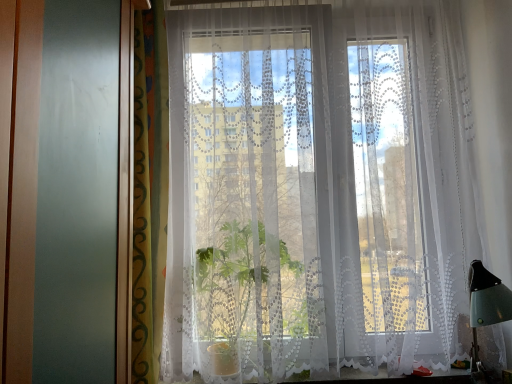
Question: From a real-world perspective, is white lace curtain at center, placed as the 2th curtain when sorted from left to right, physically above green patterned curtain at left, the first curtain positioned from the left?

Choices:
 (A) no
 (B) yes

Answer: (A)

Question: From a real-world perspective, is white lace curtain at center, placed as the 2th curtain when sorted from left to right, beneath green patterned curtain at left, arranged as the second curtain when viewed from the right?

Choices:
 (A) yes
 (B) no

Answer: (A)

Question: From the image's perspective, does white lace curtain at center, placed as the 2th curtain when sorted from left to right, appear higher than green patterned curtain at left, arranged as the second curtain when viewed from the right?

Choices:
 (A) yes
 (B) no

Answer: (A)

Question: Does white lace curtain at center, positioned as the 1th curtain in right-to-left order, appear on the right side of green patterned curtain at left, arranged as the second curtain when viewed from the right?

Choices:
 (A) no
 (B) yes

Answer: (B)

Question: Is white lace curtain at center, placed as the 2th curtain when sorted from left to right, positioned behind green patterned curtain at left, arranged as the second curtain when viewed from the right?

Choices:
 (A) yes
 (B) no

Answer: (A)

Question: Considering the relative positions of white lace curtain at center, placed as the 2th curtain when sorted from left to right, and green patterned curtain at left, the first curtain positioned from the left, in the image provided, is white lace curtain at center, placed as the 2th curtain when sorted from left to right, to the left or to the right of green patterned curtain at left, the first curtain positioned from the left,?

Choices:
 (A) left
 (B) right

Answer: (B)

Question: Is white lace curtain at center, positioned as the 1th curtain in right-to-left order, inside or outside of green patterned curtain at left, the first curtain positioned from the left?

Choices:
 (A) inside
 (B) outside

Answer: (B)

Question: Is point (266, 107) closer or farther from the camera than point (144, 264)?

Choices:
 (A) farther
 (B) closer

Answer: (A)

Question: Considering their positions, is white lace curtain at center, placed as the 2th curtain when sorted from left to right, located in front of or behind green patterned curtain at left, arranged as the second curtain when viewed from the right?

Choices:
 (A) behind
 (B) front

Answer: (A)

Question: Looking at their shapes, would you say green patterned curtain at left, arranged as the second curtain when viewed from the right, is wider or thinner than white lace curtain at center, placed as the 2th curtain when sorted from left to right?

Choices:
 (A) wide
 (B) thin

Answer: (B)

Question: Based on their positions, is green patterned curtain at left, the first curtain positioned from the left, located to the left or right of white lace curtain at center, positioned as the 1th curtain in right-to-left order?

Choices:
 (A) left
 (B) right

Answer: (A)

Question: Is green patterned curtain at left, the first curtain positioned from the left, bigger or smaller than white lace curtain at center, placed as the 2th curtain when sorted from left to right?

Choices:
 (A) small
 (B) big

Answer: (A)

Question: Is green patterned curtain at left, the first curtain positioned from the left, taller or shorter than white lace curtain at center, placed as the 2th curtain when sorted from left to right?

Choices:
 (A) short
 (B) tall

Answer: (A)

Question: From a real-world perspective, is green patterned curtain at left, arranged as the second curtain when viewed from the right, above or below white lace curtain at lower center?

Choices:
 (A) above
 (B) below

Answer: (A)

Question: Looking at the image, does green patterned curtain at left, the first curtain positioned from the left, seem bigger or smaller compared to white lace curtain at lower center?

Choices:
 (A) small
 (B) big

Answer: (B)